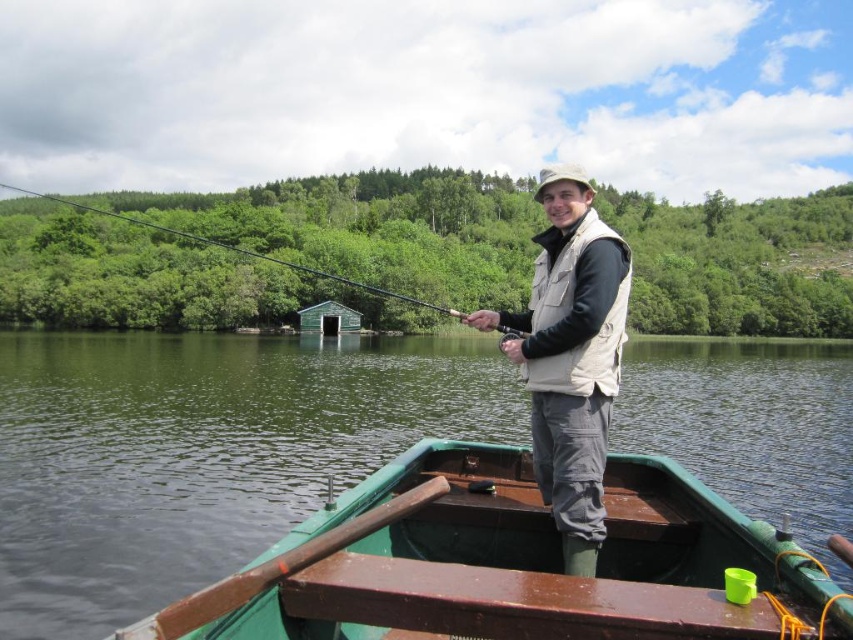
You are standing on the dock and looking at the green wooden boat at center and the green matte fishing pole at upper center. Which object appears larger in your view?

The green wooden boat at center appears larger because it is closer to you than the green matte fishing pole at upper center.

You are standing on the boat and want to place a small item between the two points labeled point (323,515) and point (543,428). Which point should you place the item closer to so that it appears closer to you?

You should place the item closer to point (323,515) because it is closer to the viewer than point (543,428).

You are an observer standing on the lakeshore looking at the green wooden boat at center and the green matte fishing pole at upper center. Which object appears larger in the image?

The green matte fishing pole at upper center appears larger because it is described as being larger than the green wooden boat at center.